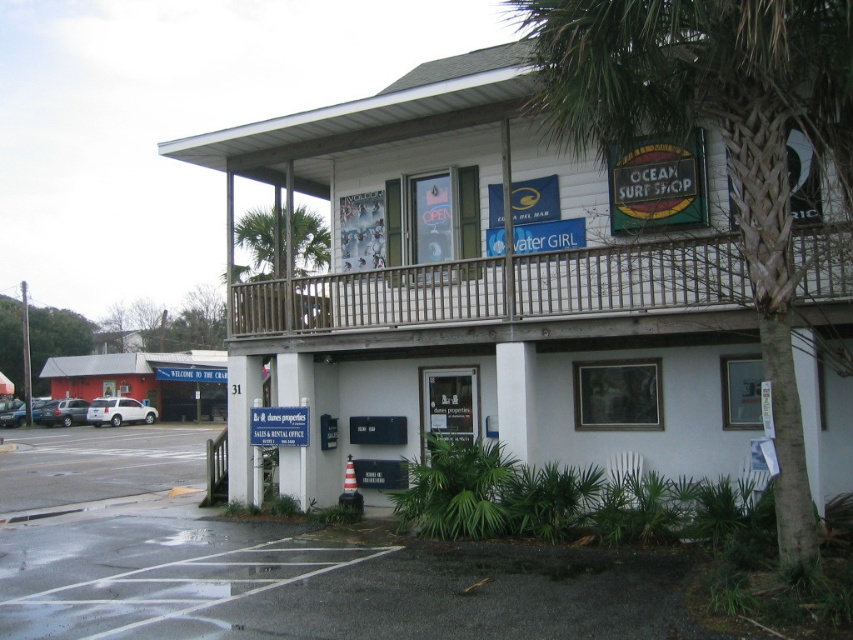
Can you confirm if gray asphalt parking lot at lower left is positioned below white plastic sign at center?

Indeed, gray asphalt parking lot at lower left is positioned under white plastic sign at center.

Between gray asphalt parking lot at lower left and white plastic sign at center, which one appears on the right side from the viewer's perspective?

Positioned to the right is white plastic sign at center.

Between point (93, 435) and point (305, 410), which one is positioned in front?

Point (305, 410) is in front.

Where is `gray asphalt parking lot at lower left`? Image resolution: width=853 pixels, height=640 pixels. gray asphalt parking lot at lower left is located at coordinates (97, 464).

Can you confirm if wooden at upper center is wider than green stained glass sign at upper right?

No.

Looking at this image, is wooden at upper center further to the viewer compared to green stained glass sign at upper right?

No, wooden at upper center is closer to the viewer.

Does point (821, 259) lie in front of point (693, 204)?

That is True.

At what (x,y) coordinates should I click in order to perform the action: click on wooden at upper center. Please return your answer as a coordinate pair (x, y). The width and height of the screenshot is (853, 640). Looking at the image, I should click on (502, 289).

Who is higher up, white wood building at center or green stained glass sign at upper right?

green stained glass sign at upper right

Does white wood building at center appear on the right side of green stained glass sign at upper right?

In fact, white wood building at center is to the left of green stained glass sign at upper right.

Where is `white wood building at center`? Image resolution: width=853 pixels, height=640 pixels. white wood building at center is located at coordinates point(482,289).

The height and width of the screenshot is (640, 853). I want to click on white wood building at center, so (x=482, y=289).